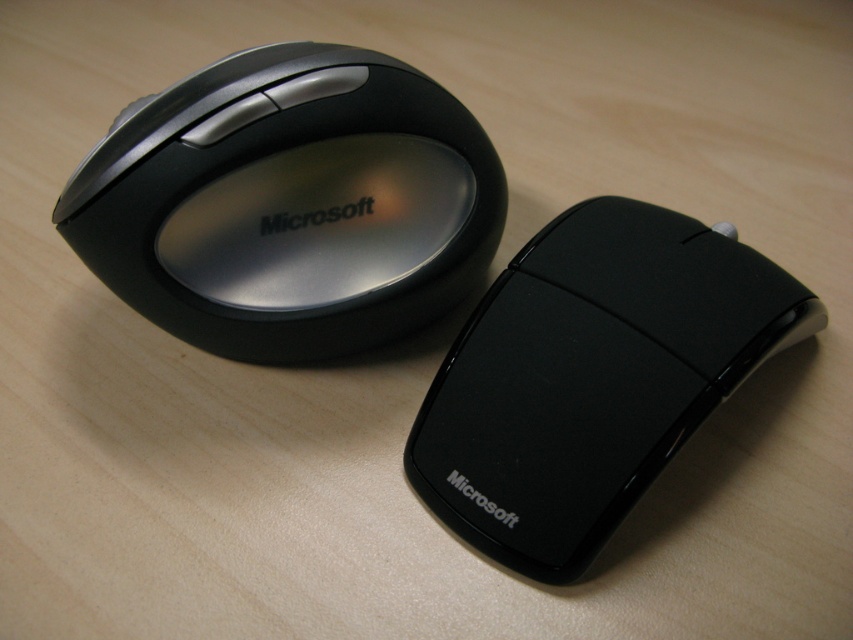
Question: Observing the image, what is the correct spatial positioning of satin black mouse at upper left in reference to black glossy mouse at center?

Choices:
 (A) left
 (B) right

Answer: (A)

Question: Which object appears closest to the camera in this image?

Choices:
 (A) satin black mouse at upper left
 (B) black glossy mouse at center

Answer: (B)

Question: Can you confirm if satin black mouse at upper left is thinner than black glossy mouse at center?

Choices:
 (A) yes
 (B) no

Answer: (B)

Question: Which object appears closest to the camera in this image?

Choices:
 (A) satin black mouse at upper left
 (B) black glossy mouse at center

Answer: (B)

Question: Does satin black mouse at upper left have a smaller size compared to black glossy mouse at center?

Choices:
 (A) no
 (B) yes

Answer: (A)